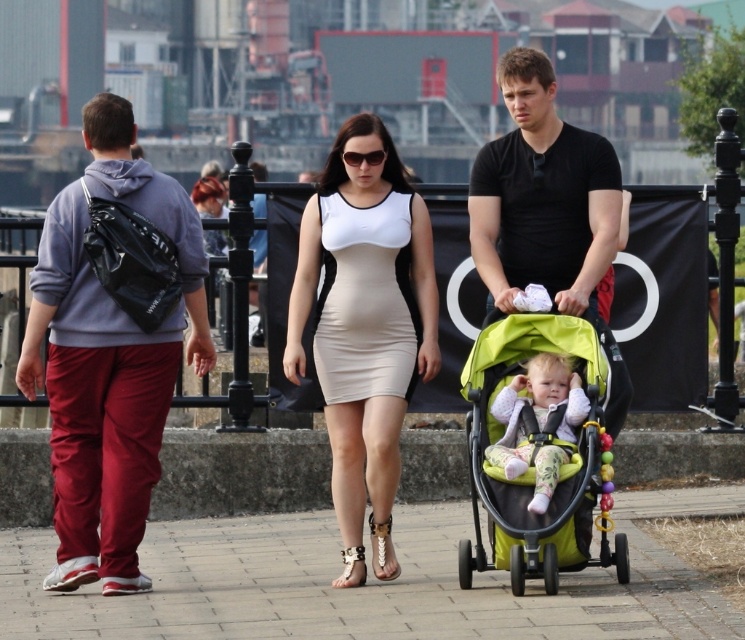
You are a photographer standing on the promenade. You want to capture a photo of the green fabric stroller at center and the fluffy pink jacket at center in the same frame. Based on their sizes, which object should you focus on to ensure both are clearly visible in the photo?

The green fabric stroller at center is bigger than the fluffy pink jacket at center, so focusing on the green fabric stroller at center would ensure both objects are clearly visible in the photo.

You are a photographer standing on the promenade trying to capture a photo of the green fabric stroller at center and the fluffy pink jacket at center. Based on their positions, which object should you adjust your camera to focus on first if you want to include both in the frame without moving your position?

The green fabric stroller at center is positioned on the right side of the fluffy pink jacket at center, so you should focus on the fluffy pink jacket at center first to ensure both are in the frame without moving your position.

You are a photographer taking a picture of the matte white dress at center and the beige matte dress at center. Which dress should you focus on if you want to capture the one that is shorter?

The matte white dress at center is shorter than the beige matte dress at center, so you should focus on the matte white dress at center to capture the shorter one.